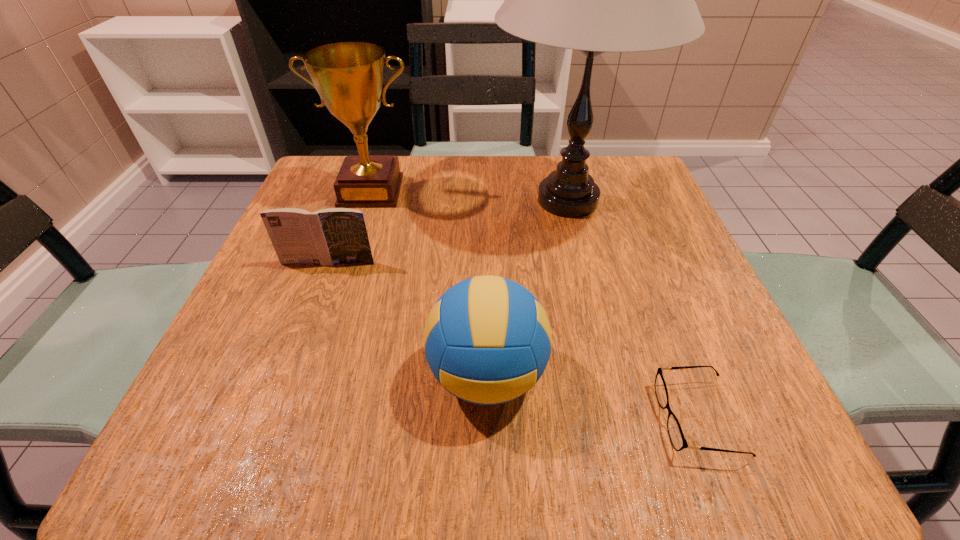
Locate which object ranks in proximity to the spectacles. Please provide its 2D coordinates. Your answer should be formatted as a tuple, i.e. [(x, y)], where the tuple contains the x and y coordinates of a point satisfying the conditions above.

[(487, 340)]

Find the location of a particular element. vacant space that satisfies the following two spatial constraints: 1. on the back side of the tallest object; 2. on the left side of the third shortest object is located at coordinates (485, 200).

Find the location of a particular element. The image size is (960, 540). free region that satisfies the following two spatial constraints: 1. on the plaque of the award; 2. on the left side of the tallest object is located at coordinates (368, 200).

Find the location of a particular element. This screenshot has height=540, width=960. blank space that satisfies the following two spatial constraints: 1. on the plaque of the volleyball; 2. on the left side of the second tallest object is located at coordinates [x=312, y=375].